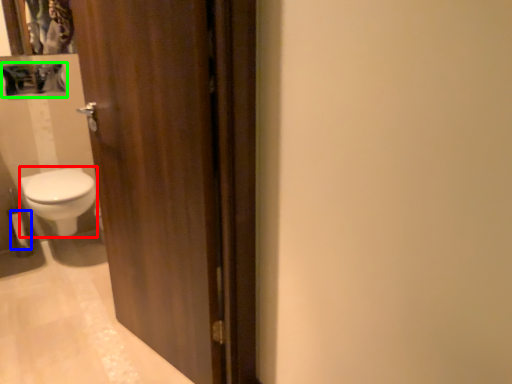
Question: Considering the real-world distances, which object is farthest from bidet (highlighted by a red box)? toilet paper (highlighted by a blue box) or medicine cabinet (highlighted by a green box)?

Choices:
 (A) toilet paper
 (B) medicine cabinet

Answer: (B)